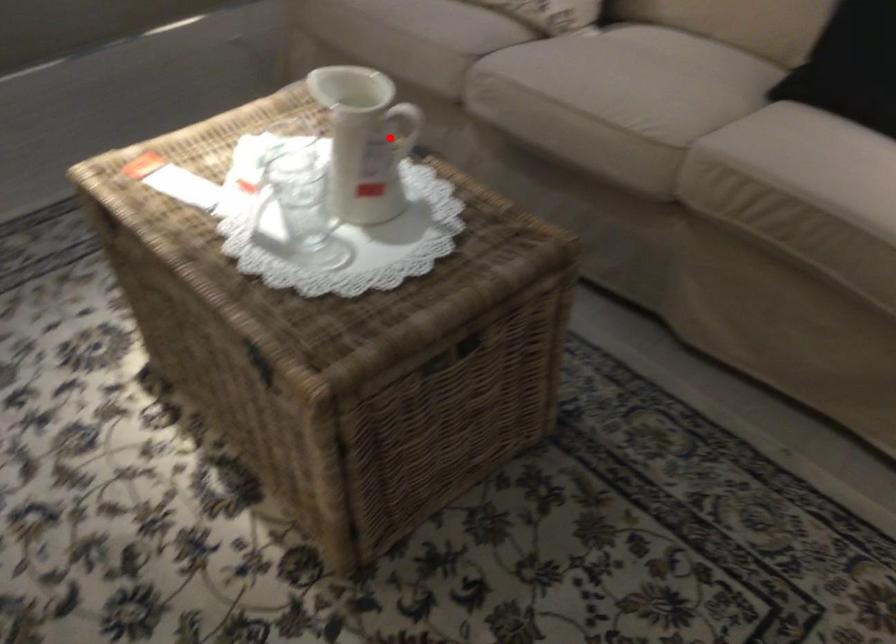
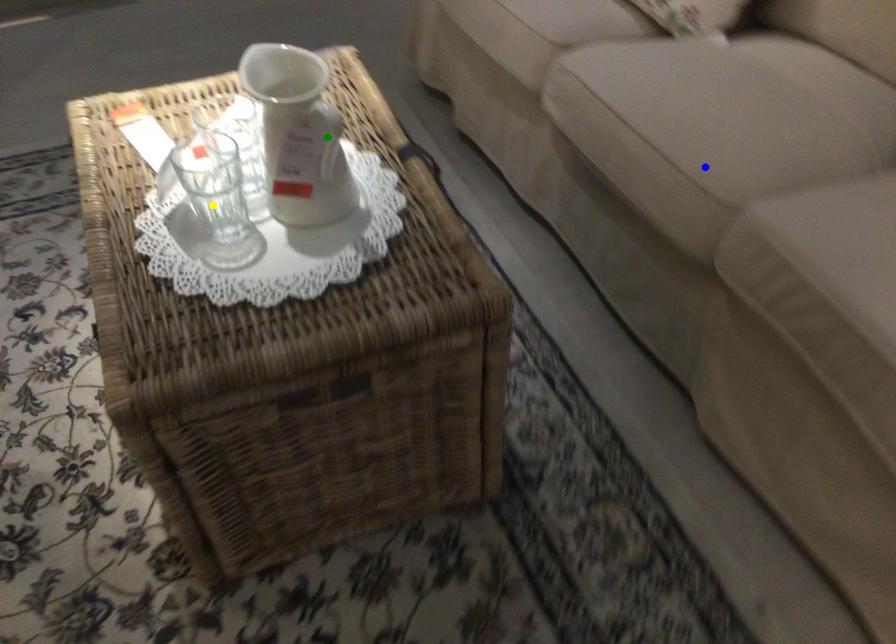
Question: I am providing you with two images of the same scene from different viewpoints. A red point is marked on the first image. You are given multiple points on the second image. Which point in image 2 is actually the same real-world point as the red point in image 1?

Choices:
 (A) green point
 (B) yellow point
 (C) blue point

Answer: (A)